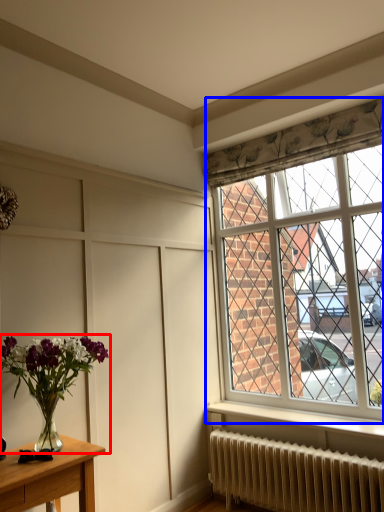
Question: Which object is further to the camera taking this photo, houseplant (highlighted by a red box) or window (highlighted by a blue box)?

Choices:
 (A) houseplant
 (B) window

Answer: (B)